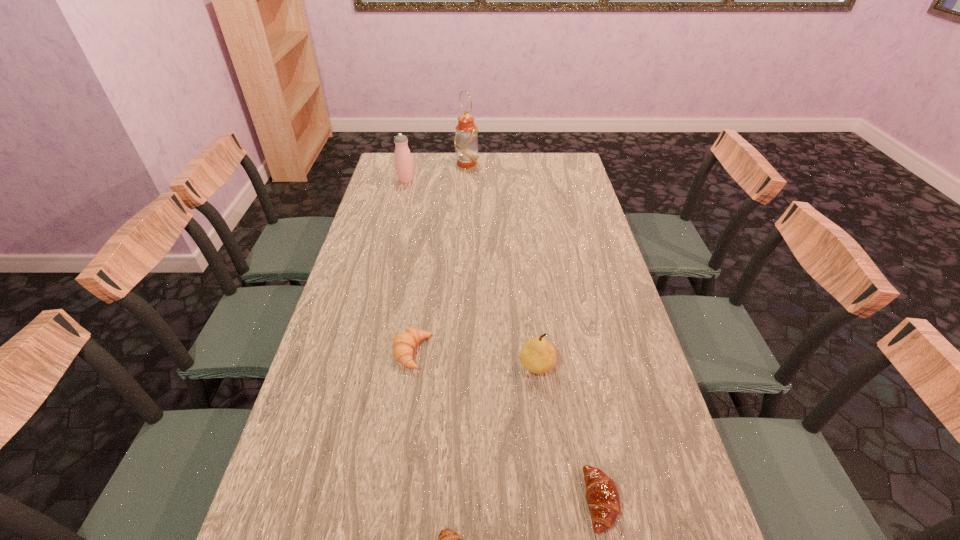
Identify the location of vacant region at the left edge. This screenshot has width=960, height=540. (401, 192).

Identify the location of vacant space at the right edge. (558, 202).

Locate an element on the screen. vacant region at the far left corner of the desktop is located at coordinates (396, 177).

Image resolution: width=960 pixels, height=540 pixels. In order to click on free spot at the far right corner of the desktop in this screenshot , I will do `click(575, 169)`.

This screenshot has height=540, width=960. Identify the location of free spot between the farthest object and the fifth object from right to left. (440, 258).

Identify the location of free space between the pear and the farthest object. (502, 265).

This screenshot has width=960, height=540. What are the coordinates of `vacant area between the fifth object from right to left and the fourth shortest object` in the screenshot? It's located at (475, 359).

The image size is (960, 540). Find the location of `vacant space that's between the leftmost crescent roll and the oil lamp`. vacant space that's between the leftmost crescent roll and the oil lamp is located at coordinates (440, 258).

The height and width of the screenshot is (540, 960). Identify the location of vacant space that's between the fifth object from right to left and the pear. (475, 359).

The width and height of the screenshot is (960, 540). I want to click on vacant space that is in between the rightmost object and the leftmost crescent roll, so click(507, 427).